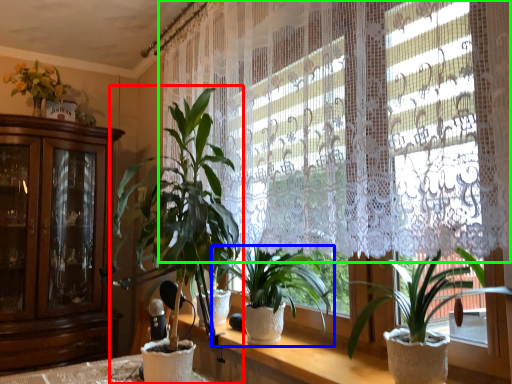
Question: Estimate the real-world distances between objects in this image. Which object is closer to houseplant (highlighted by a red box), houseplant (highlighted by a blue box) or curtain (highlighted by a green box)?

Choices:
 (A) houseplant
 (B) curtain

Answer: (A)